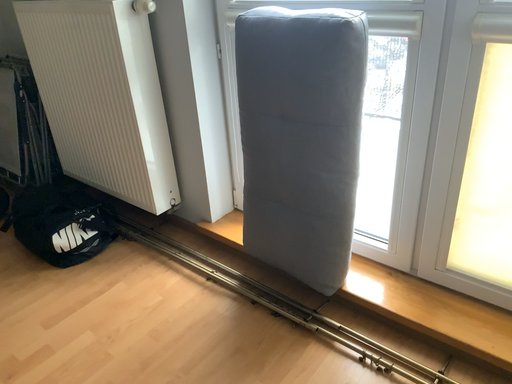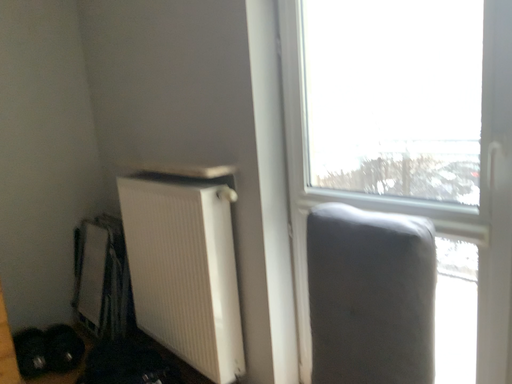
Question: Which way did the camera rotate in the video?

Choices:
 (A) rotated upward
 (B) rotated downward

Answer: (A)